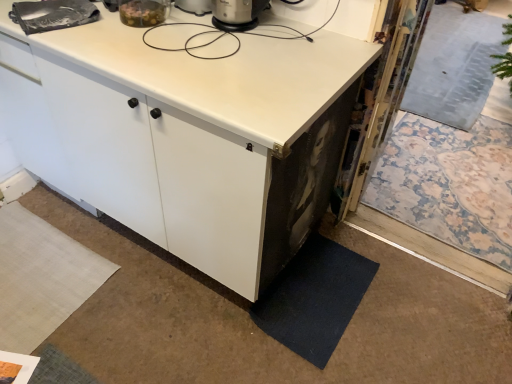
Question: Is the position of white matte cabinet at center less distant than that of white matte countertop at upper center?

Choices:
 (A) yes
 (B) no

Answer: (B)

Question: Is white matte cabinet at center taller than white matte countertop at upper center?

Choices:
 (A) yes
 (B) no

Answer: (A)

Question: Does white matte cabinet at center have a lesser width compared to white matte countertop at upper center?

Choices:
 (A) yes
 (B) no

Answer: (A)

Question: From the image's perspective, is white matte cabinet at center above white matte countertop at upper center?

Choices:
 (A) no
 (B) yes

Answer: (B)

Question: Is white matte countertop at upper center inside white matte cabinet at center?

Choices:
 (A) no
 (B) yes

Answer: (A)

Question: In the image, is white matte countertop at upper center positioned in front of or behind white matte cabinet at center?

Choices:
 (A) behind
 (B) front

Answer: (B)

Question: From the image's perspective, is white matte countertop at upper center positioned above or below white matte cabinet at center?

Choices:
 (A) below
 (B) above

Answer: (A)

Question: Which is correct: white matte countertop at upper center is inside white matte cabinet at center, or outside of it?

Choices:
 (A) inside
 (B) outside

Answer: (B)

Question: Based on their positions, is white matte countertop at upper center located to the left or right of white matte cabinet at center?

Choices:
 (A) left
 (B) right

Answer: (B)

Question: From a real-world perspective, is white matte cabinet at center positioned above or below dark blue carpet at lower right?

Choices:
 (A) below
 (B) above

Answer: (B)

Question: Considering the positions of point (271, 127) and point (331, 314), is point (271, 127) closer or farther from the camera than point (331, 314)?

Choices:
 (A) closer
 (B) farther

Answer: (A)

Question: Is white matte cabinet at center in front of or behind dark blue carpet at lower right in the image?

Choices:
 (A) behind
 (B) front

Answer: (B)

Question: Choose the correct answer: Is white matte cabinet at center inside dark blue carpet at lower right or outside it?

Choices:
 (A) inside
 (B) outside

Answer: (B)

Question: From the image's perspective, is white matte cabinet at center above or below white matte countertop at upper center?

Choices:
 (A) above
 (B) below

Answer: (A)

Question: Is white matte cabinet at center to the left or to the right of white matte countertop at upper center in the image?

Choices:
 (A) left
 (B) right

Answer: (A)